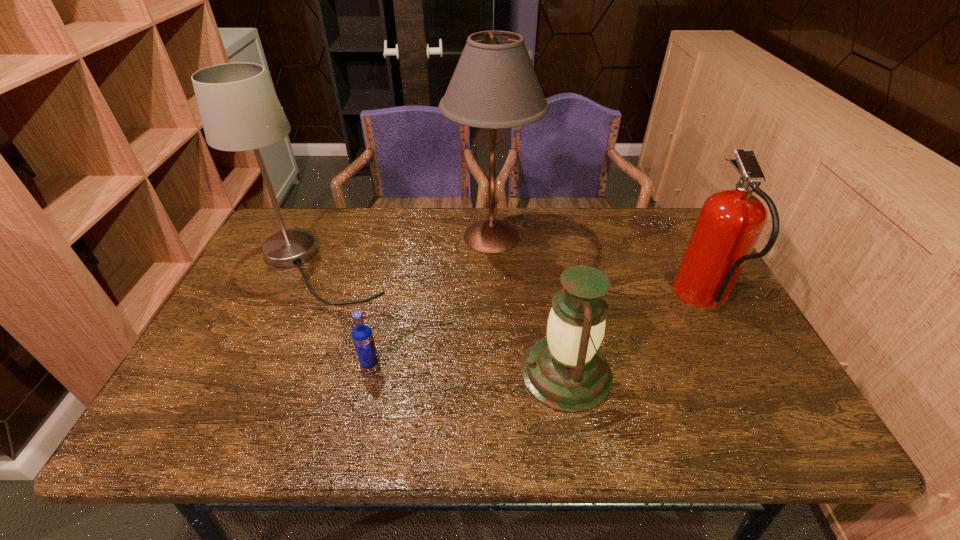
The width and height of the screenshot is (960, 540). I want to click on the right table lamp, so click(x=494, y=86).

Where is `the left table lamp`? Image resolution: width=960 pixels, height=540 pixels. the left table lamp is located at coordinates pos(239,109).

You are a GUI agent. You are given a task and a screenshot of the screen. Output one action in this format:
    pyautogui.click(x=<x>, y=<y>)
    Task: Click on the fire extinguisher
    This screenshot has height=540, width=960.
    Given the screenshot: What is the action you would take?
    pyautogui.click(x=730, y=223)

Where is `the third tallest object`? The height and width of the screenshot is (540, 960). the third tallest object is located at coordinates (730, 223).

At what (x,y) coordinates should I click in order to perform the action: click on lantern. Please return your answer as a coordinate pair (x, y). Looking at the image, I should click on (565, 371).

Where is `vodka`? This screenshot has height=540, width=960. vodka is located at coordinates (362, 336).

The width and height of the screenshot is (960, 540). Find the location of `free location located on the front-facing side of the right table lamp`. free location located on the front-facing side of the right table lamp is located at coordinates (329, 237).

Identify the location of free spot located on the front-facing side of the right table lamp. (332, 237).

The height and width of the screenshot is (540, 960). Find the location of `vacant area situated 0.140m on the front-facing side of the right table lamp`. vacant area situated 0.140m on the front-facing side of the right table lamp is located at coordinates (402, 237).

Where is `free point located 0.080m on the back of the left table lamp`? The height and width of the screenshot is (540, 960). free point located 0.080m on the back of the left table lamp is located at coordinates [x=341, y=219].